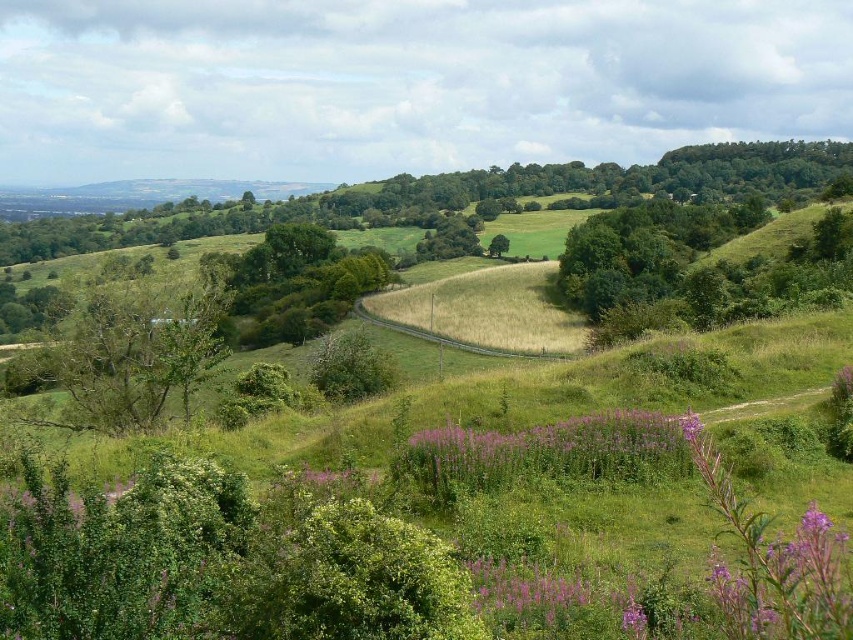
Question: Estimate the real-world distances between objects in this image. Which object is closer to the green leafy tree at left?

Choices:
 (A) green leafy tree at center
 (B) purple soft grass at center

Answer: (B)

Question: Considering the relative positions of green leafy tree at left and green leafy tree at center in the image provided, where is green leafy tree at left located with respect to green leafy tree at center?

Choices:
 (A) left
 (B) right

Answer: (A)

Question: Estimate the real-world distances between objects in this image. Which object is farther from the purple soft grass at center?

Choices:
 (A) green leafy tree at center
 (B) green leafy tree at left

Answer: (A)

Question: In this image, where is green leafy tree at left located relative to purple soft grass at center?

Choices:
 (A) left
 (B) right

Answer: (A)

Question: Which is nearer to the green leafy tree at left?

Choices:
 (A) green leafy tree at center
 (B) purple soft grass at center

Answer: (B)

Question: In this image, where is green leafy tree at left located relative to purple soft grass at center?

Choices:
 (A) below
 (B) above

Answer: (B)